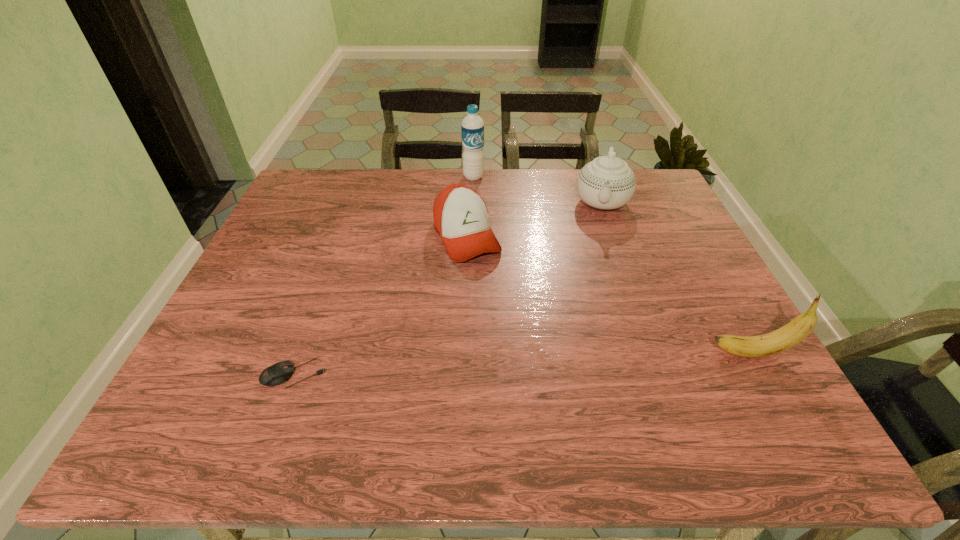
Where is `free space located on the front-facing side of the baseball cap`? This screenshot has width=960, height=540. free space located on the front-facing side of the baseball cap is located at coordinates (523, 338).

The image size is (960, 540). Identify the location of free space located 0.340m on the front-facing side of the baseball cap. (540, 366).

Locate an element on the screen. The width and height of the screenshot is (960, 540). free space located on the front-facing side of the baseball cap is located at coordinates (510, 316).

Locate an element on the screen. The width and height of the screenshot is (960, 540). vacant space located 0.240m on the label of the water bottle is located at coordinates (480, 226).

This screenshot has height=540, width=960. Identify the location of free space located 0.210m on the label of the water bottle. (479, 219).

Find the location of a particular element. This screenshot has height=540, width=960. vacant space located 0.390m on the label of the water bottle is located at coordinates (485, 259).

Locate an element on the screen. The image size is (960, 540). free spot located 0.310m on the spout of the fourth object from left to right is located at coordinates (593, 295).

The height and width of the screenshot is (540, 960). In order to click on vacant point located 0.160m on the spout of the fourth object from left to right in this screenshot , I will do `click(597, 257)`.

At what (x,y) coordinates should I click in order to perform the action: click on vacant position located on the spout of the fourth object from left to right. Please return your answer as a coordinate pair (x, y). Looking at the image, I should click on (594, 282).

I want to click on baseball cap positioned at the far edge, so click(x=460, y=215).